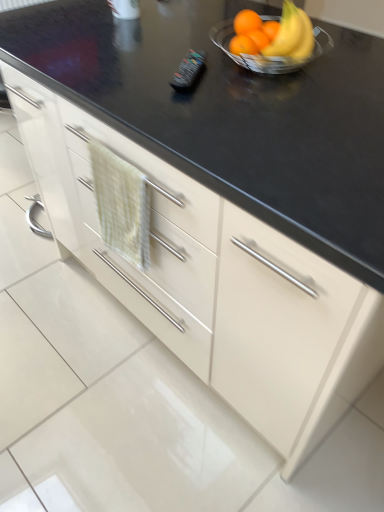
At what (x,y) coordinates should I click in order to perform the action: click on free space between clear glass bowl at upper right and black plastic remote control at center. Please return your answer as a coordinate pair (x, y). Looking at the image, I should click on (223, 78).